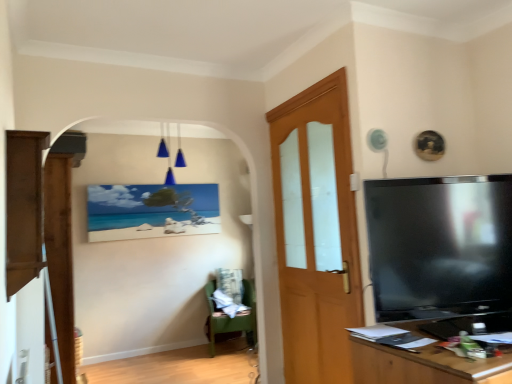
Where is `free space in front of green fabric chair at lower left`? Image resolution: width=512 pixels, height=384 pixels. free space in front of green fabric chair at lower left is located at coordinates (219, 362).